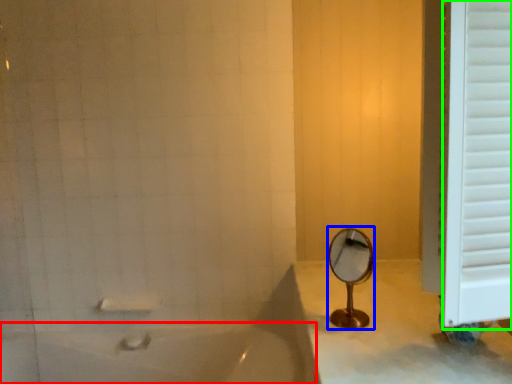
Question: Based on their relative distances, which object is farther from bathtub (highlighted by a red box)? Choose from mirror (highlighted by a blue box) and window frame (highlighted by a green box).

Choices:
 (A) mirror
 (B) window frame

Answer: (B)